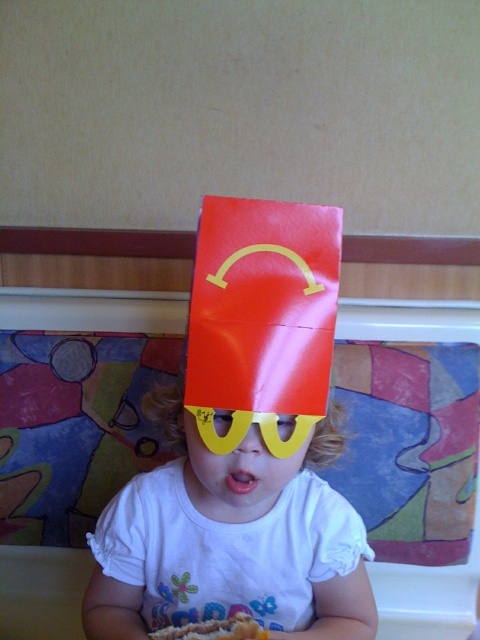
Who is taller, yellow plastic glasses at center or golden crispy french fries at lower center?

With more height is yellow plastic glasses at center.

Who is more distant from viewer, (x=213, y=465) or (x=236, y=624)?

Point (x=236, y=624)

Identify the location of yellow plastic glasses at center. (236, 474).

Between white matte shirt at center and golden crispy french fries at lower center, which one is positioned lower?

golden crispy french fries at lower center is below.

Can you confirm if white matte shirt at center is thinner than golden crispy french fries at lower center?

No.

Where is `white matte shirt at center`? Image resolution: width=480 pixels, height=640 pixels. white matte shirt at center is located at coordinates (230, 540).

What are the coordinates of `white matte shirt at center` in the screenshot? It's located at (230, 540).

Based on the photo, between white matte shirt at center and yellow plastic glasses at center, which one appears on the right side from the viewer's perspective?

white matte shirt at center is more to the right.

Is the position of white matte shirt at center less distant than that of yellow plastic glasses at center?

No, white matte shirt at center is further to the viewer.

This screenshot has width=480, height=640. What do you see at coordinates (230, 540) in the screenshot? I see `white matte shirt at center` at bounding box center [230, 540].

You are a GUI agent. You are given a task and a screenshot of the screen. Output one action in this format:
    pyautogui.click(x=<x>, y=<y>)
    Task: Click on the white matte shirt at center
    The image size is (480, 640).
    Given the screenshot: What is the action you would take?
    pyautogui.click(x=230, y=540)